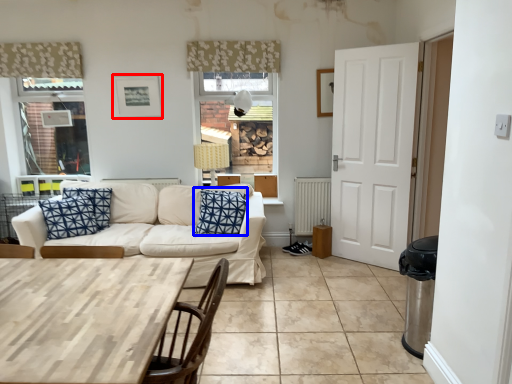
Question: Which of the following is the closest to the observer, picture frame (highlighted by a red box) or pillow (highlighted by a blue box)?

Choices:
 (A) picture frame
 (B) pillow

Answer: (B)